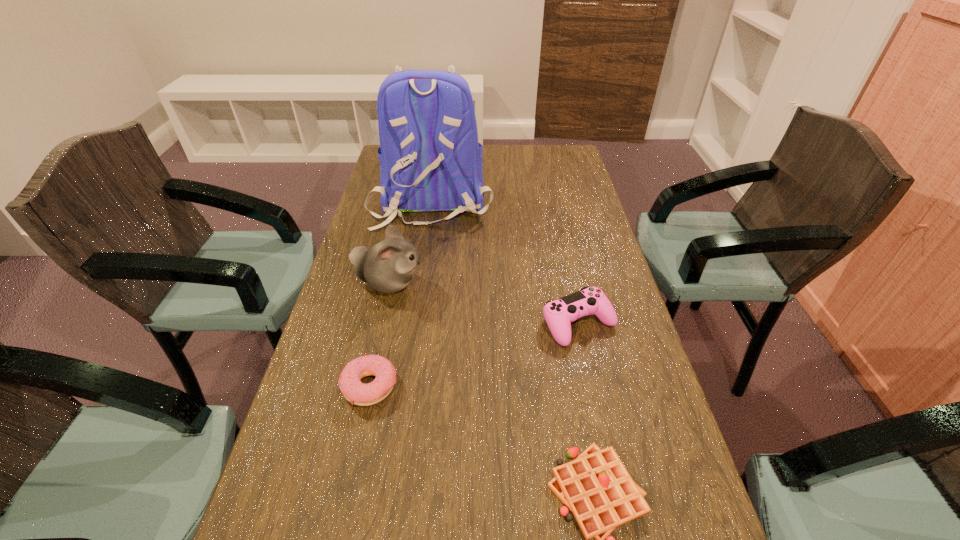
Find the location of `backpack`. backpack is located at coordinates (430, 159).

You are a GUI agent. You are given a task and a screenshot of the screen. Output one action in this format:
    pyautogui.click(x=<x>, y=<y>)
    Task: Click on the tallest object
    
    Given the screenshot: What is the action you would take?
    pyautogui.click(x=430, y=159)

The width and height of the screenshot is (960, 540). What are the coordinates of `hamster` in the screenshot? It's located at (388, 267).

I want to click on the third shortest object, so [559, 314].

Where is `the second shortest object`? the second shortest object is located at coordinates (356, 392).

Identify the location of the second nearest object. (356, 392).

Where is `blank space located on the back of the farthest object`? This screenshot has width=960, height=540. blank space located on the back of the farthest object is located at coordinates (424, 253).

At what (x,y) coordinates should I click in order to perform the action: click on free space located on the face of the fourth shortest object. Please return your answer as a coordinate pair (x, y). Looking at the image, I should click on (494, 284).

Where is `blank area located on the left of the third shortest object`? blank area located on the left of the third shortest object is located at coordinates (471, 323).

Identify the location of vacant space located 0.320m on the right of the second shortest object. The height and width of the screenshot is (540, 960). (548, 386).